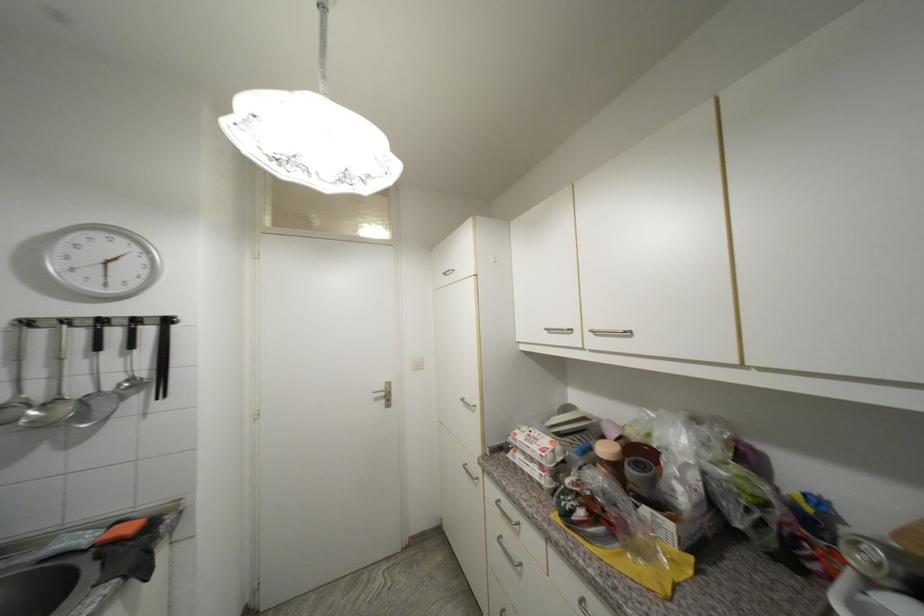
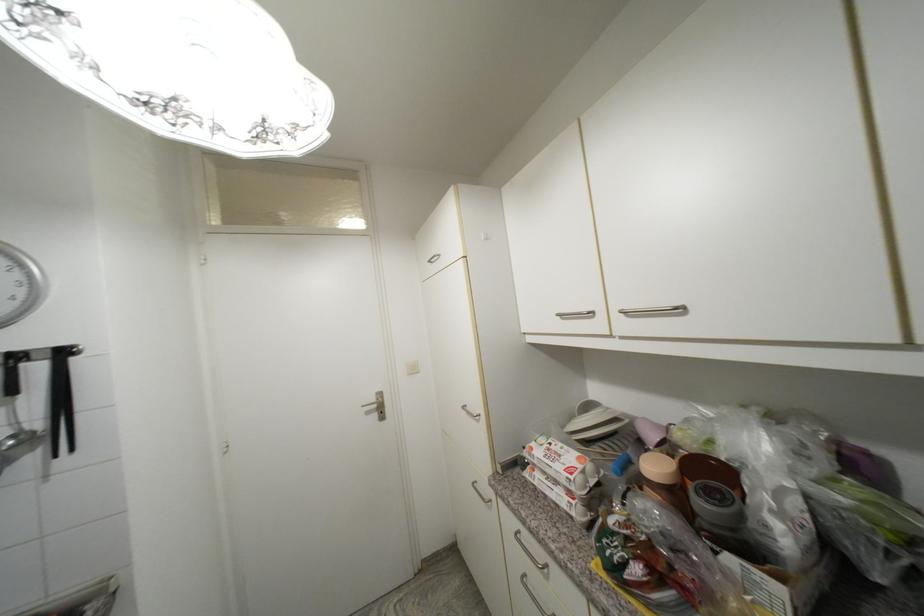
The point at (141, 322) is marked in the first image. Where is the corresponding point in the second image?

(22, 359)